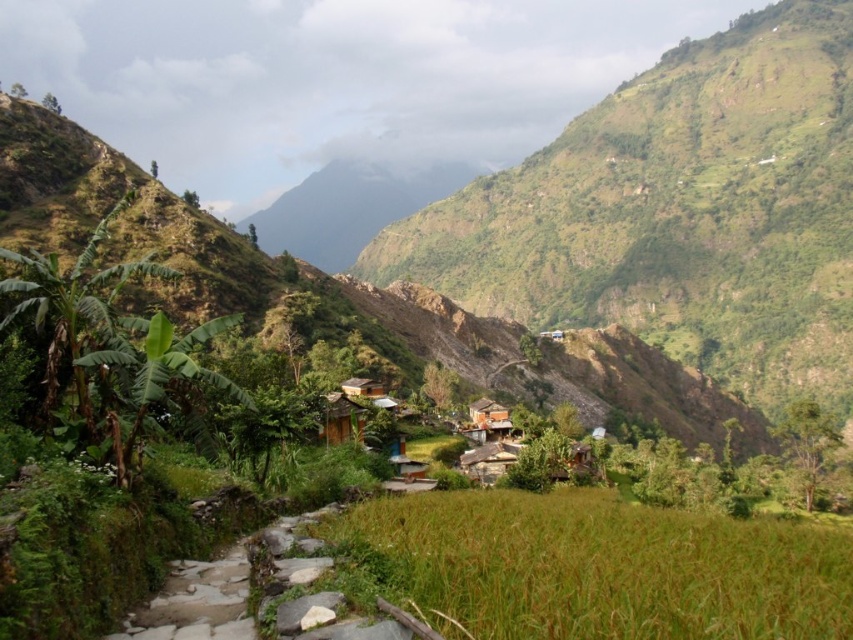
Question: Which of these objects is positioned farthest from the green grassy hill at center?

Choices:
 (A) gray stone path at lower left
 (B) brown wooden hut at center
 (C) brown grassy rice field at lower center

Answer: (A)

Question: Which point is closer to the camera taking this photo?

Choices:
 (A) (729, 388)
 (B) (471, 404)

Answer: (B)

Question: Does brown grassy rice field at lower center have a greater width compared to gray stone path at lower left?

Choices:
 (A) yes
 (B) no

Answer: (A)

Question: Does gray stone path at lower left have a larger size compared to brown wooden hut at center?

Choices:
 (A) yes
 (B) no

Answer: (B)

Question: Among these objects, which one is nearest to the camera?

Choices:
 (A) gray stone path at lower left
 (B) green grassy hill at center
 (C) brown grassy rice field at lower center

Answer: (C)

Question: Does green grassy hill at center have a greater width compared to brown grassy rice field at lower center?

Choices:
 (A) no
 (B) yes

Answer: (B)